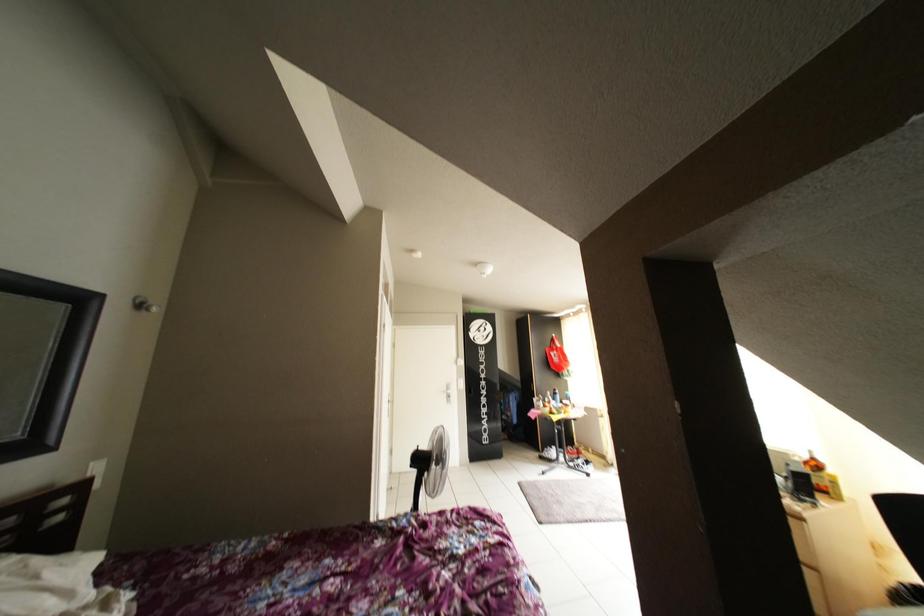
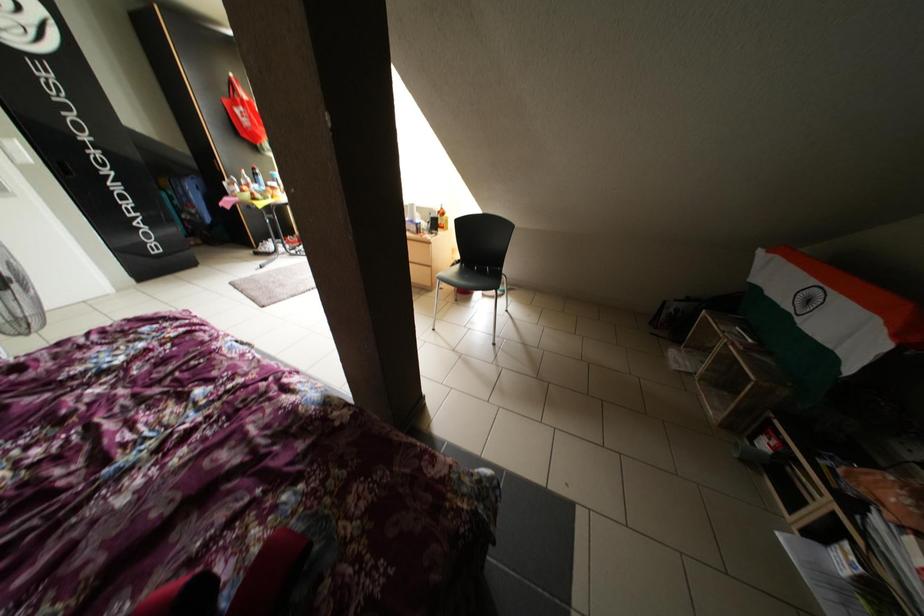
How did the camera likely rotate?

The camera's rotation is toward right-down.